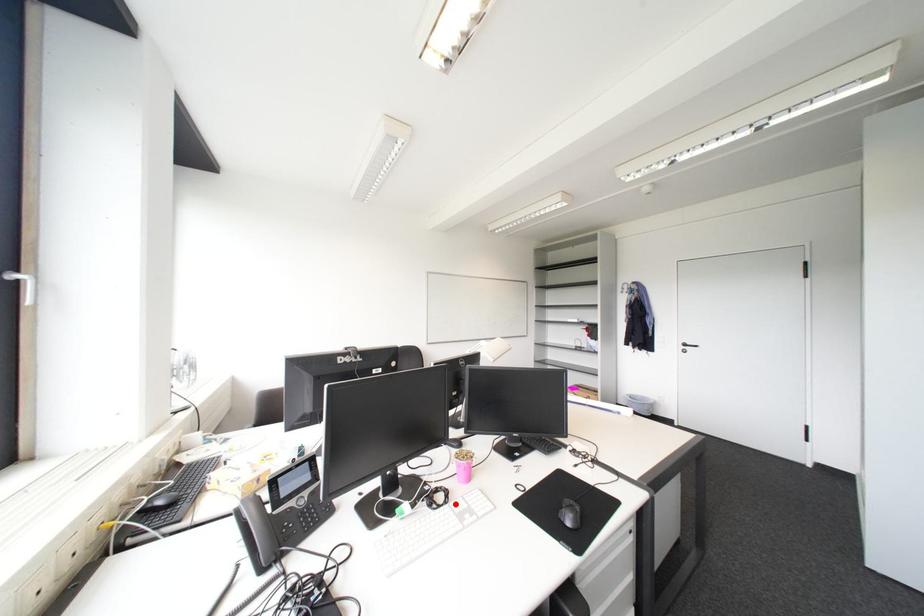
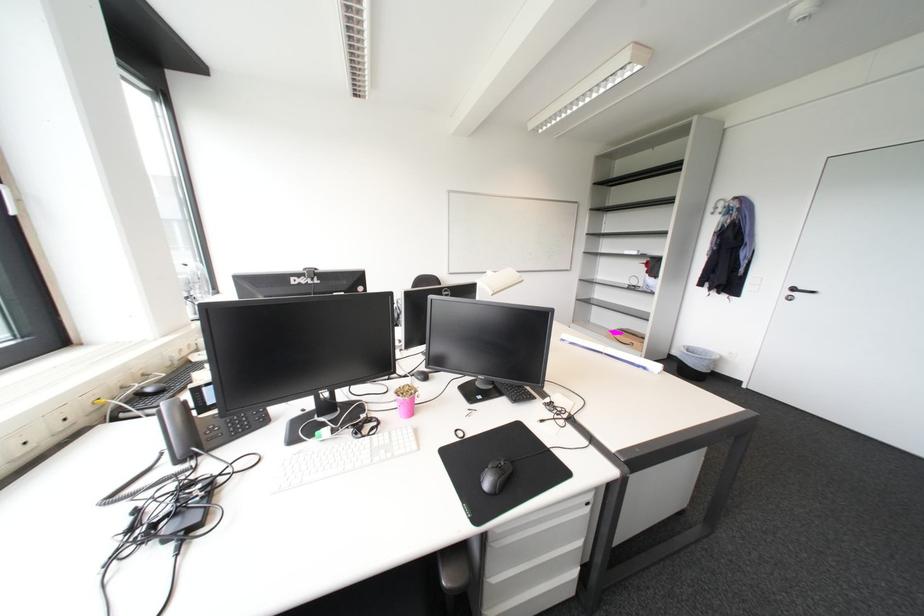
Find the pixel in the second image that matches the highlighted location in the first image.

(379, 436)